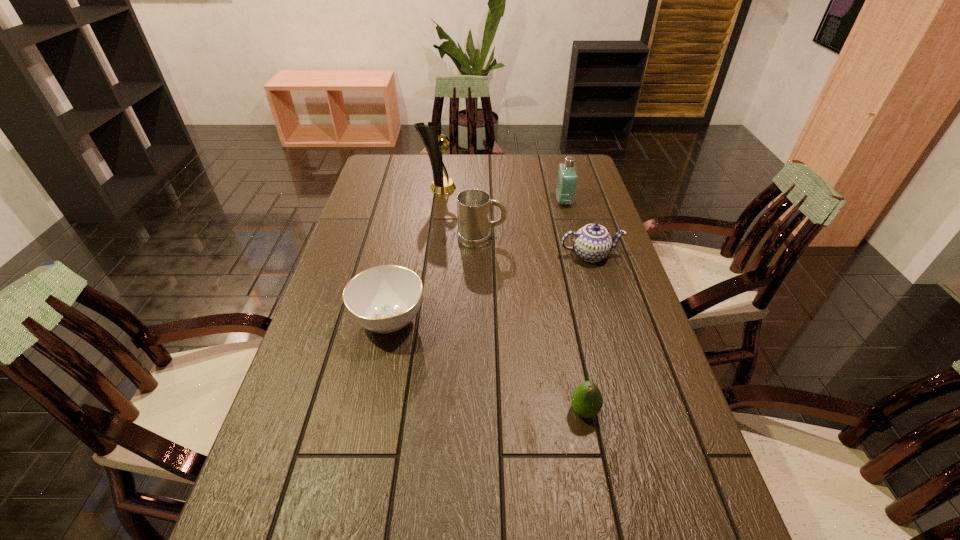
Where is `the tallest object`? Image resolution: width=960 pixels, height=540 pixels. the tallest object is located at coordinates (431, 135).

What are the coordinates of `perfume` in the screenshot? It's located at (567, 177).

You are a GUI agent. You are given a task and a screenshot of the screen. Output one action in this format:
    pyautogui.click(x=<x>, y=<y>)
    Task: Click on the third object from left to right
    This screenshot has height=540, width=960.
    Given the screenshot: What is the action you would take?
    pos(473,205)

Identify the location of the farther chinaware. The height and width of the screenshot is (540, 960). (x=592, y=243).

Locate an element on the screen. This screenshot has width=960, height=540. the left chinaware is located at coordinates (383, 299).

Locate an element on the screen. This screenshot has width=960, height=540. the fifth farthest object is located at coordinates coord(383,299).

Find the location of a particular element. Image resolution: width=960 pixels, height=540 pixels. the nearest object is located at coordinates (587, 401).

The height and width of the screenshot is (540, 960). Find the location of `vacant space situated 0.350m at the front of the award, where the globe is visible`. vacant space situated 0.350m at the front of the award, where the globe is visible is located at coordinates (547, 188).

I want to click on vacant space located 0.350m on the front label of the perfume, so pos(460,201).

This screenshot has width=960, height=540. Find the location of `free location located on the front label of the perfume`. free location located on the front label of the perfume is located at coordinates (507, 201).